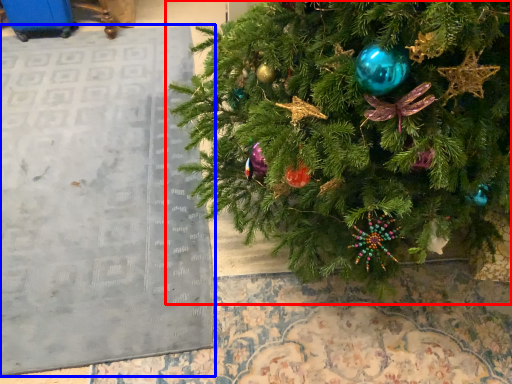
Question: Which object is closer to the camera taking this photo, christmas tree (highlighted by a red box) or bulletin board (highlighted by a blue box)?

Choices:
 (A) christmas tree
 (B) bulletin board

Answer: (A)